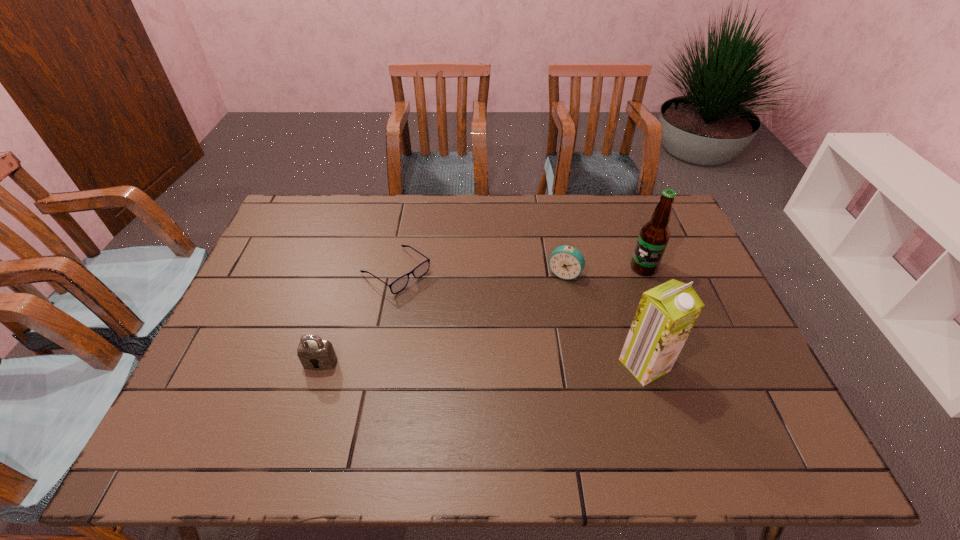
Locate an element on the screen. This screenshot has height=540, width=960. vacant space on the desktop that is between the padlock and the soya milk and is positioned on the front-facing side of the third object from right to left is located at coordinates (521, 364).

Where is `free spot on the desktop that is between the padlock and the soya milk and is positioned on the label of the beer bottle`? This screenshot has height=540, width=960. free spot on the desktop that is between the padlock and the soya milk and is positioned on the label of the beer bottle is located at coordinates (453, 363).

The image size is (960, 540). In order to click on vacant space on the desktop that is between the padlock and the soya milk and is positioned on the front-facing side of the shortest object in this screenshot , I will do `click(523, 364)`.